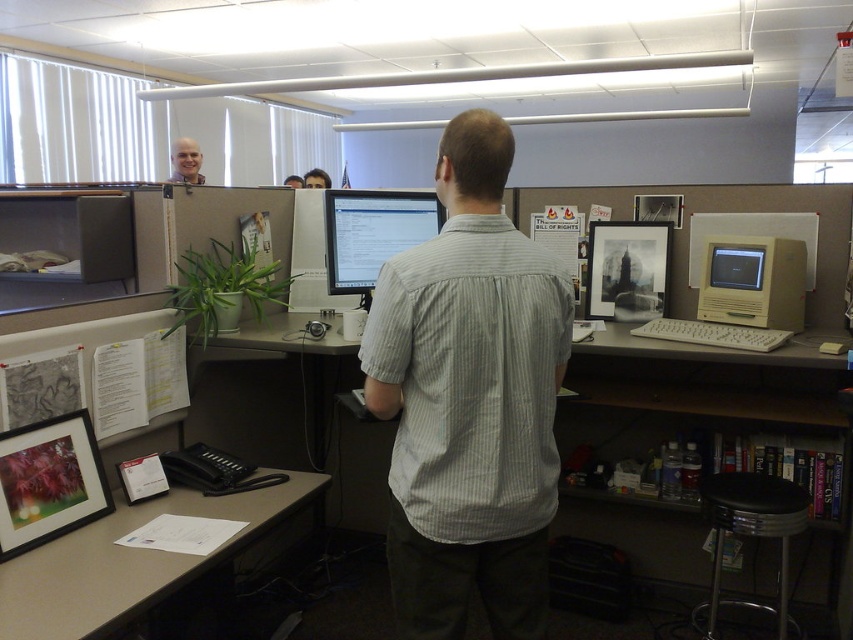
Question: Which point is closer to the camera?

Choices:
 (A) (173, 148)
 (B) (294, 186)
 (C) (62, 596)

Answer: (C)

Question: Which of these objects is positioned closest to the beige plastic desktop computer at right?

Choices:
 (A) matte black monitor at center
 (B) smooth skin bald man at upper center
 (C) white plastic computer desk at center
 (D) matte beige monitor at center right

Answer: (D)

Question: Which point appears farthest from the camera in this image?

Choices:
 (A) 288,186
 (B) 740,260
 (C) 730,300

Answer: (A)

Question: Does beige plastic desktop computer at right have a greater width compared to black leather stool at lower right?

Choices:
 (A) yes
 (B) no

Answer: (A)

Question: Where is white plastic computer desk at center located in relation to beige laminate desk at lower left in the image?

Choices:
 (A) above
 (B) below

Answer: (A)

Question: Where is beige plastic desktop computer at right located in relation to smooth skin face at upper left in the image?

Choices:
 (A) below
 (B) above

Answer: (A)